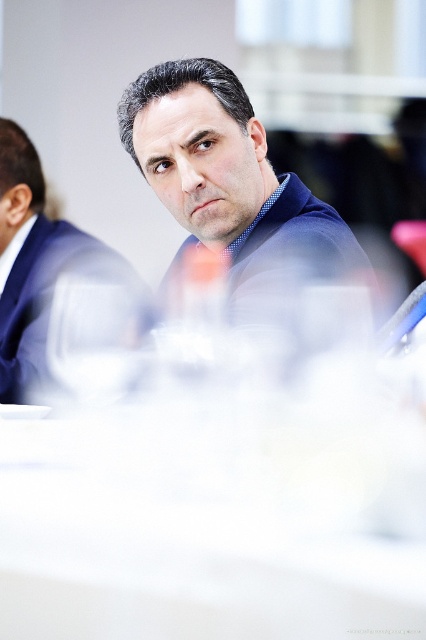
You are a photographer adjusting your camera settings to focus on the white glossy table at center and the matte blue suit at center. Since the table is closer, will it appear more in focus than the suit?

The white glossy table at center is closer to the viewer than the matte blue suit at center, so it will appear more in focus.